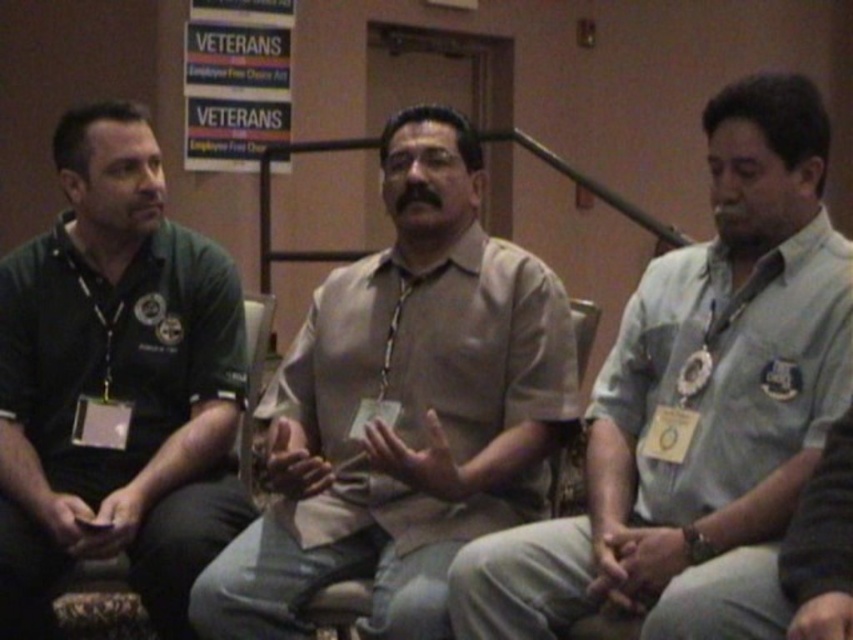
Based on the scene description, where exactly is the dark green polo shirt at left located in the image?

The dark green polo shirt at left is located at point [115,381].

Based on the scene described, which object, the beige fabric shirt at center or the wooden chair at center, occupies a greater spatial area in the image?

The beige fabric shirt at center has a larger size compared to the wooden chair at center, so it occupies a greater spatial area in the image.

Where is the beige fabric shirt at center located in the image?

The beige fabric shirt at center is located at point (404, 406).